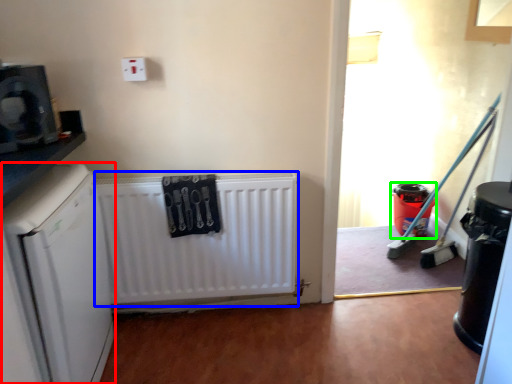
Question: Which object is positioned closest to dish washer (highlighted by a red box)? Select from radiator (highlighted by a blue box) and appliance (highlighted by a green box).

Choices:
 (A) radiator
 (B) appliance

Answer: (A)